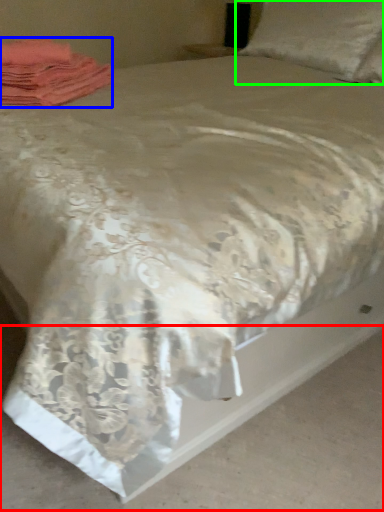
Question: Estimate the real-world distances between objects in this image. Which object is farther from concrete (highlighted by a red box), material (highlighted by a blue box) or pillow (highlighted by a green box)?

Choices:
 (A) material
 (B) pillow

Answer: (B)